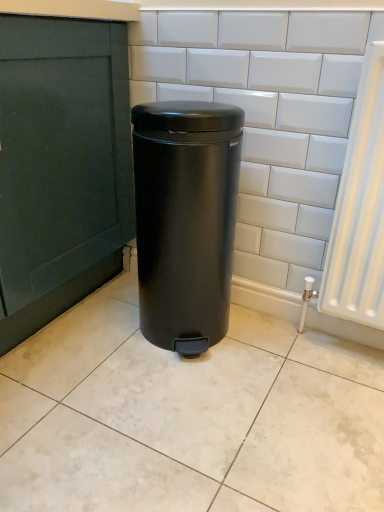
Question: Do you think matte black trash can at center is within white glossy ceramic tile at center, or outside of it?

Choices:
 (A) outside
 (B) inside

Answer: (A)

Question: Is matte black trash can at center bigger or smaller than white glossy ceramic tile at center?

Choices:
 (A) big
 (B) small

Answer: (A)

Question: Based on their positions, is matte black trash can at center located to the left or right of white glossy ceramic tile at center?

Choices:
 (A) left
 (B) right

Answer: (B)

Question: Is white glossy ceramic tile at center spatially inside matte black trash can at center, or outside of it?

Choices:
 (A) outside
 (B) inside

Answer: (A)

Question: In the image, is white glossy ceramic tile at center on the left side or the right side of matte black trash can at center?

Choices:
 (A) right
 (B) left

Answer: (B)

Question: In terms of width, does white glossy ceramic tile at center look wider or thinner when compared to matte black trash can at center?

Choices:
 (A) thin
 (B) wide

Answer: (B)

Question: Does point (135, 399) appear closer or farther from the camera than point (223, 184)?

Choices:
 (A) closer
 (B) farther

Answer: (B)